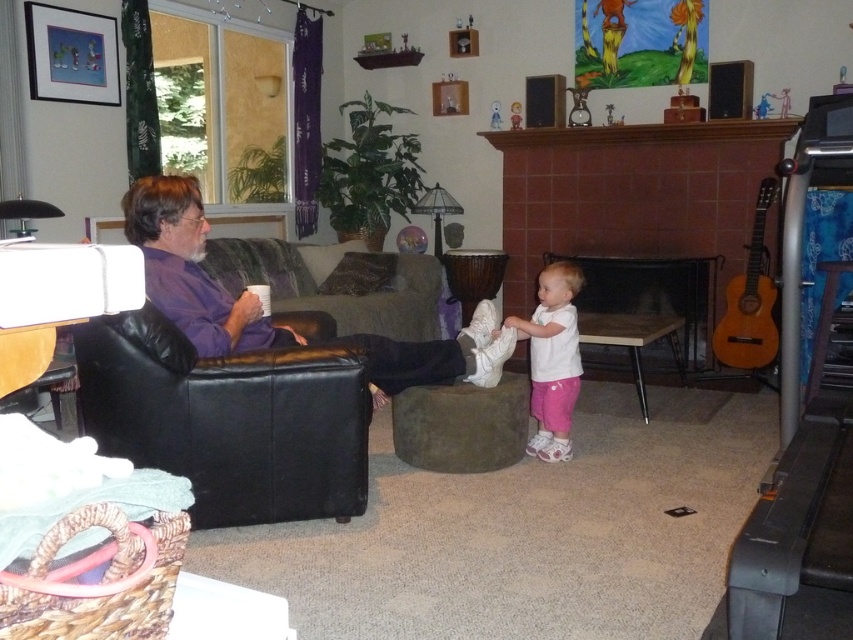
Question: Among these objects, which one is nearest to the camera?

Choices:
 (A) white matte shirt at center
 (B) black leather bean bag chair at left
 (C) black metal fireplace at center

Answer: (B)

Question: Estimate the real-world distances between objects in this image. Which object is closer to the black leather bean bag chair at left?

Choices:
 (A) black metal fireplace at center
 (B) brown tile fireplace at center

Answer: (A)

Question: Does black leather bean bag chair at left come in front of brown tile fireplace at center?

Choices:
 (A) yes
 (B) no

Answer: (A)

Question: Among these points, which one is nearest to the camera?

Choices:
 (A) (656, 124)
 (B) (160, 378)
 (C) (538, 372)

Answer: (B)

Question: Where is brown tile fireplace at center located in relation to black metal fireplace at center in the image?

Choices:
 (A) above
 (B) below

Answer: (A)

Question: Does black metal fireplace at center have a smaller size compared to white matte shirt at center?

Choices:
 (A) no
 (B) yes

Answer: (A)